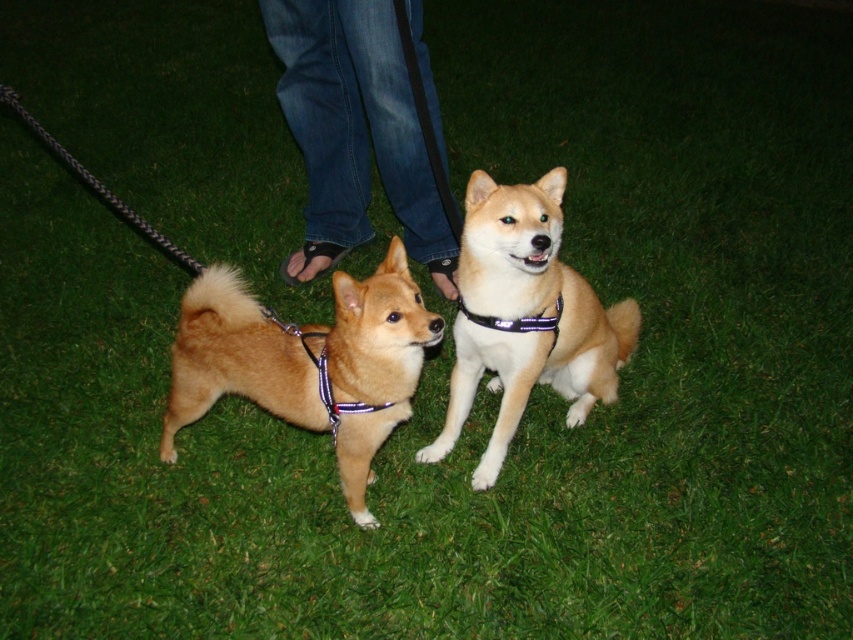
Measure the distance from jeans at center to black fabric neckband at center.

jeans at center is 4.25 feet away from black fabric neckband at center.

Who is higher up, jeans at center or black fabric neckband at center?

jeans at center is above.

What do you see at coordinates (355, 132) in the screenshot? This screenshot has width=853, height=640. I see `jeans at center` at bounding box center [355, 132].

This screenshot has width=853, height=640. I want to click on jeans at center, so click(355, 132).

Is point (297, 35) farther from viewer compared to point (352, 433)?

Yes.

Is point (346, 106) positioned in front of point (358, 337)?

No, (346, 106) is behind (358, 337).

In order to click on jeans at center in this screenshot , I will do `click(355, 132)`.

Is the position of shiny brown dog at center less distant than that of light brown fur at center?

Yes.

Where is `shiny brown dog at center`? The image size is (853, 640). shiny brown dog at center is located at coordinates (306, 362).

Describe the element at coordinates (306, 362) in the screenshot. I see `shiny brown dog at center` at that location.

The image size is (853, 640). I want to click on shiny brown dog at center, so click(x=306, y=362).